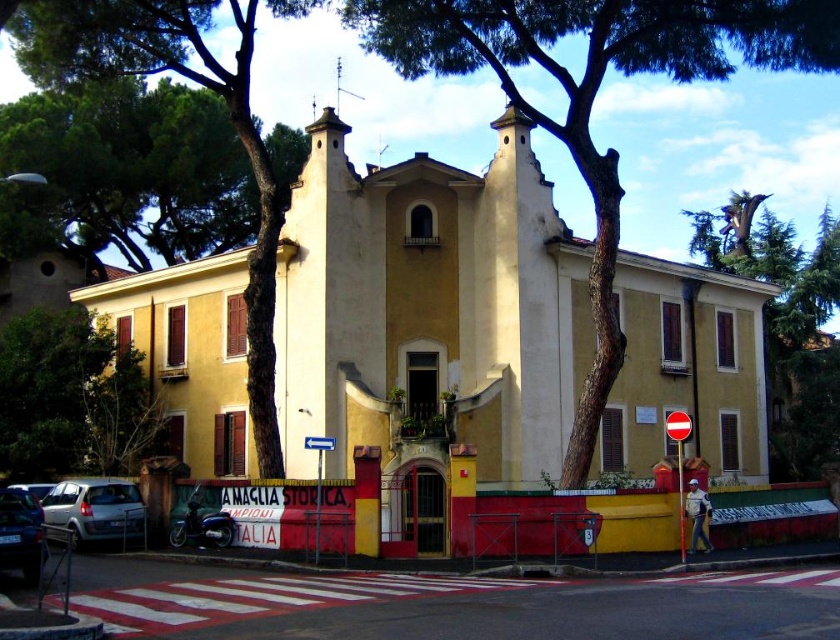
Who is positioned more to the right, yellow matte building at center or green leafy tree at upper left?

yellow matte building at center is more to the right.

Who is positioned more to the left, yellow matte building at center or green leafy tree at upper left?

Positioned to the left is green leafy tree at upper left.

Measure the distance between yellow matte building at center and camera.

yellow matte building at center is 166.78 feet away from camera.

You are a GUI agent. You are given a task and a screenshot of the screen. Output one action in this format:
    pyautogui.click(x=<x>, y=<y>)
    Task: Click on the yellow matte building at center
    The image size is (840, 640).
    Given the screenshot: What is the action you would take?
    pyautogui.click(x=428, y=317)

Does green leafy tree at upper left appear on the left side of metallic silver car at lower left?

Indeed, green leafy tree at upper left is positioned on the left side of metallic silver car at lower left.

Which is in front, point (159, 22) or point (37, 563)?

Positioned in front is point (37, 563).

At what (x,y) coordinates should I click in order to perform the action: click on green leafy tree at upper left. Please return your answer as a coordinate pair (x, y). The width and height of the screenshot is (840, 640). Looking at the image, I should click on (202, 86).

Is yellow matte building at center thinner than green rough bark tree at center?

No.

Is yellow matte building at center to the left of green rough bark tree at center from the viewer's perspective?

Correct, you'll find yellow matte building at center to the left of green rough bark tree at center.

Is point (373, 369) behind point (626, 72)?

That is False.

The height and width of the screenshot is (640, 840). Identify the location of yellow matte building at center. (428, 317).